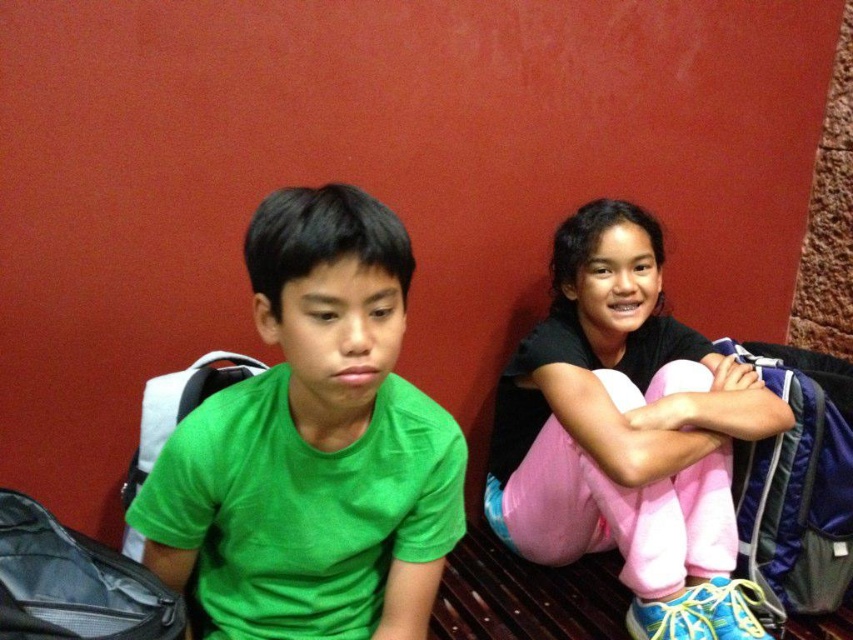
You are a photographer setting up for a group photo. You need to ensure that the green matte shirt at center and the pink fleece pants at center are both in focus. Given that your camera has a depth of field that can cover 25 inches, will both items be in focus?

The distance between the green matte shirt at center and the pink fleece pants at center is 25.64 inches, which exceeds the camera depth of field of 25 inches. Therefore, both items may not be fully in focus.

You are a tailor measuring fabric for alterations. You need to determine which item, the green matte shirt at center or the pink fleece pants at center, requires more vertical fabric length to accommodate its height. Based on the image, which item would need more fabric in the vertical direction?

The pink fleece pants at center require more vertical fabric length because the green matte shirt at center is not as tall as the pink fleece pants at center.